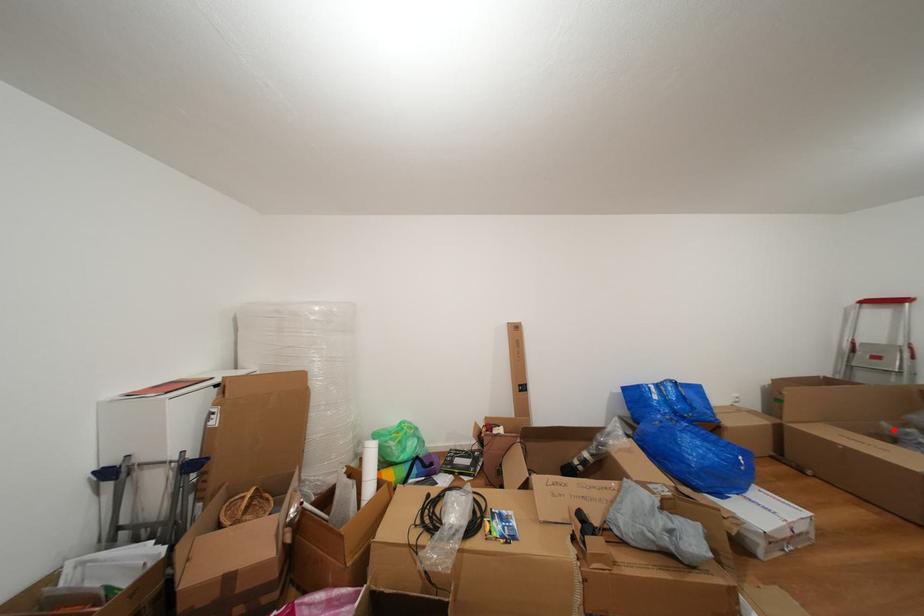
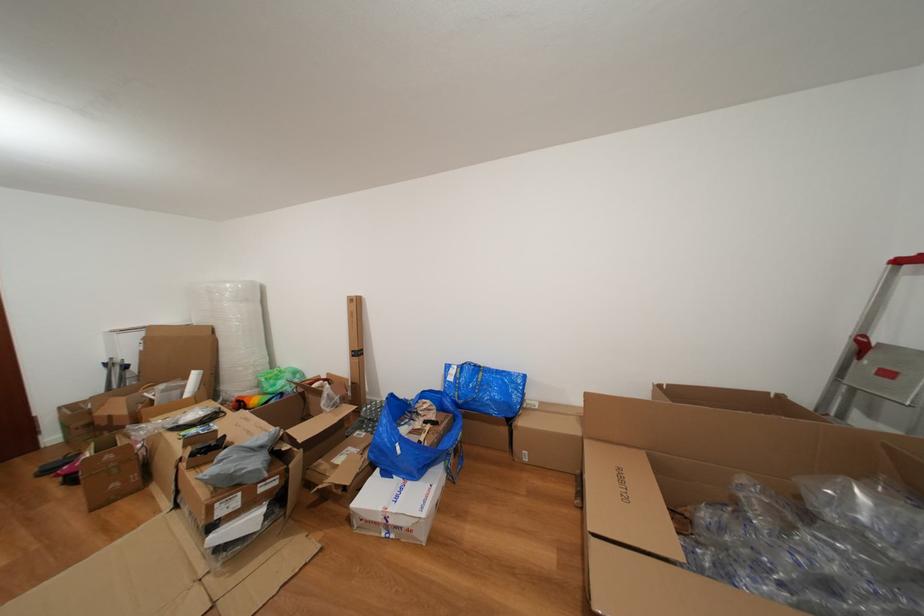
Find the pixel in the second image that matches the highlighted location in the first image.

(750, 485)